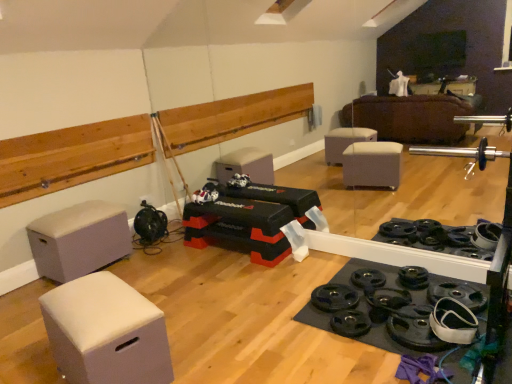
What is the approximate width of gray fabric ottoman at left, the 1th furniture in the back-to-front sequence?

The width of gray fabric ottoman at left, the 1th furniture in the back-to-front sequence, is 16.66 inches.

Image resolution: width=512 pixels, height=384 pixels. Identify the location of matte plastic toy at center. (206, 194).

Image resolution: width=512 pixels, height=384 pixels. I want to click on gray fabric ottoman at left, the 1th furniture in the back-to-front sequence, so click(79, 240).

How different are the orientations of matte plastic toy at center and gray fabric ottoman at left, which is the 2th furniture in front-to-back order, in degrees?

The angle between the facing direction of matte plastic toy at center and the facing direction of gray fabric ottoman at left, which is the 2th furniture in front-to-back order, is 94.3 degrees.

Is matte plastic toy at center facing away from gray fabric ottoman at left, the first furniture positioned from the left?

matte plastic toy at center does not have its back to gray fabric ottoman at left, the first furniture positioned from the left.

Considering the sizes of matte plastic toy at center and gray fabric ottoman at left, which is the 2th furniture from right to left, in the image, is matte plastic toy at center wider or thinner than gray fabric ottoman at left, which is the 2th furniture from right to left,?

Considering their sizes, matte plastic toy at center looks slimmer than gray fabric ottoman at left, which is the 2th furniture from right to left.

In the scene shown: Is matte plastic toy at center far away from gray fabric ottoman at left, the 1th furniture in the back-to-front sequence?

matte plastic toy at center is far away from gray fabric ottoman at left, the 1th furniture in the back-to-front sequence.

Can you confirm if matte plastic toy at center is shorter than white fabric ottoman at lower left, the 1th furniture in the front-to-back sequence?

Indeed, matte plastic toy at center has a lesser height compared to white fabric ottoman at lower left, the 1th furniture in the front-to-back sequence.

From a real-world perspective, between matte plastic toy at center and white fabric ottoman at lower left, the 1th furniture in the front-to-back sequence, who is vertically higher?

matte plastic toy at center is physically above.

In the image, is matte plastic toy at center positioned in front of or behind white fabric ottoman at lower left, acting as the second furniture starting from the back?

In the image, matte plastic toy at center appears behind white fabric ottoman at lower left, acting as the second furniture starting from the back.

Locate an element on the screen. toy above the white fabric ottoman at lower left, acting as the second furniture starting from the back (from a real-world perspective) is located at coordinates (206, 194).

In terms of size, does white fabric ottoman at lower left, the 1th furniture in the front-to-back sequence, appear bigger or smaller than gray fabric ottoman at left, which is the 2th furniture in front-to-back order?

Considering their sizes, white fabric ottoman at lower left, the 1th furniture in the front-to-back sequence, takes up less space than gray fabric ottoman at left, which is the 2th furniture in front-to-back order.

Is white fabric ottoman at lower left, which ranks as the second furniture in left-to-right order, oriented towards gray fabric ottoman at left, which is the 2th furniture from right to left?

No, white fabric ottoman at lower left, which ranks as the second furniture in left-to-right order, is not aimed at gray fabric ottoman at left, which is the 2th furniture from right to left.

Locate an element on the screen. The image size is (512, 384). furniture on the right of gray fabric ottoman at left, the first furniture positioned from the left is located at coordinates (106, 332).

Who is bigger, white fabric ottoman at lower left, positioned as the 1th furniture in right-to-left order, or matte plastic toy at center?

With larger size is white fabric ottoman at lower left, positioned as the 1th furniture in right-to-left order.

Are white fabric ottoman at lower left, which ranks as the second furniture in left-to-right order, and matte plastic toy at center beside each other?

No, white fabric ottoman at lower left, which ranks as the second furniture in left-to-right order, is not touching matte plastic toy at center.

This screenshot has width=512, height=384. In order to click on toy behind the white fabric ottoman at lower left, positioned as the 1th furniture in right-to-left order in this screenshot , I will do `click(206, 194)`.

Is matte plastic toy at center at the back of white fabric ottoman at lower left, which ranks as the second furniture in left-to-right order?

No.

Is gray fabric ottoman at left, the first furniture positioned from the left, positioned before white fabric ottoman at lower left, which ranks as the second furniture in left-to-right order?

No, the depth of gray fabric ottoman at left, the first furniture positioned from the left, is greater than that of white fabric ottoman at lower left, which ranks as the second furniture in left-to-right order.

Is gray fabric ottoman at left, which is the 2th furniture from right to left, in contact with white fabric ottoman at lower left, the 1th furniture in the front-to-back sequence?

They are not placed beside each other.

Who is bigger, gray fabric ottoman at left, the first furniture positioned from the left, or white fabric ottoman at lower left, which ranks as the second furniture in left-to-right order?

gray fabric ottoman at left, the first furniture positioned from the left.

From a real-world perspective, does gray fabric ottoman at left, the first furniture positioned from the left, sit lower than white fabric ottoman at lower left, which ranks as the second furniture in left-to-right order?

Incorrect, from a real-world perspective, gray fabric ottoman at left, the first furniture positioned from the left, is higher than white fabric ottoman at lower left, which ranks as the second furniture in left-to-right order.

From a real-world perspective, who is located higher, gray fabric ottoman at left, which is the 2th furniture from right to left, or matte plastic toy at center?

From a 3D spatial view, matte plastic toy at center is above.

Is gray fabric ottoman at left, which is the 2th furniture in front-to-back order, with matte plastic toy at center?

There is a gap between gray fabric ottoman at left, which is the 2th furniture in front-to-back order, and matte plastic toy at center.

Does gray fabric ottoman at left, which is the 2th furniture from right to left, lie behind matte plastic toy at center?

No.

Locate an element on the screen. the 2nd furniture to the left of the matte plastic toy at center, counting from the anchor's position is located at coordinates (79, 240).

I want to click on the 2nd furniture positioned below the matte plastic toy at center (from a real-world perspective), so pyautogui.click(x=106, y=332).

Consider the image. Based on their spatial positions, is gray fabric ottoman at left, which is the 2th furniture from right to left, or matte plastic toy at center closer to white fabric ottoman at lower left, which ranks as the second furniture in left-to-right order?

Among the two, gray fabric ottoman at left, which is the 2th furniture from right to left, is located nearer to white fabric ottoman at lower left, which ranks as the second furniture in left-to-right order.

From the image, which object appears to be farther from matte plastic toy at center, gray fabric ottoman at left, which is the 2th furniture from right to left, or white fabric ottoman at lower left, positioned as the 1th furniture in right-to-left order?

white fabric ottoman at lower left, positioned as the 1th furniture in right-to-left order, is positioned further to the anchor matte plastic toy at center.

Considering their positions, is white fabric ottoman at lower left, which ranks as the second furniture in left-to-right order, positioned closer to matte plastic toy at center than gray fabric ottoman at left, the first furniture positioned from the left?

gray fabric ottoman at left, the first furniture positioned from the left, is closer to matte plastic toy at center.

Based on their spatial positions, is matte plastic toy at center or white fabric ottoman at lower left, which ranks as the second furniture in left-to-right order, further from gray fabric ottoman at left, which is the 2th furniture in front-to-back order?

The object further to gray fabric ottoman at left, which is the 2th furniture in front-to-back order, is white fabric ottoman at lower left, which ranks as the second furniture in left-to-right order.

Considering their positions, is white fabric ottoman at lower left, positioned as the 1th furniture in right-to-left order, positioned further to gray fabric ottoman at left, the 1th furniture in the back-to-front sequence, than matte plastic toy at center?

white fabric ottoman at lower left, positioned as the 1th furniture in right-to-left order.

Looking at the image, which one is located closer to white fabric ottoman at lower left, positioned as the 1th furniture in right-to-left order, matte plastic toy at center or gray fabric ottoman at left, which is the 2th furniture in front-to-back order?

The object closer to white fabric ottoman at lower left, positioned as the 1th furniture in right-to-left order, is gray fabric ottoman at left, which is the 2th furniture in front-to-back order.

You are a GUI agent. You are given a task and a screenshot of the screen. Output one action in this format:
    pyautogui.click(x=<x>, y=<y>)
    Task: Click on the furniture between white fabric ottoman at lower left, acting as the second furniture starting from the back, and matte plastic toy at center in the front-back direction
    The width and height of the screenshot is (512, 384).
    Given the screenshot: What is the action you would take?
    pyautogui.click(x=79, y=240)